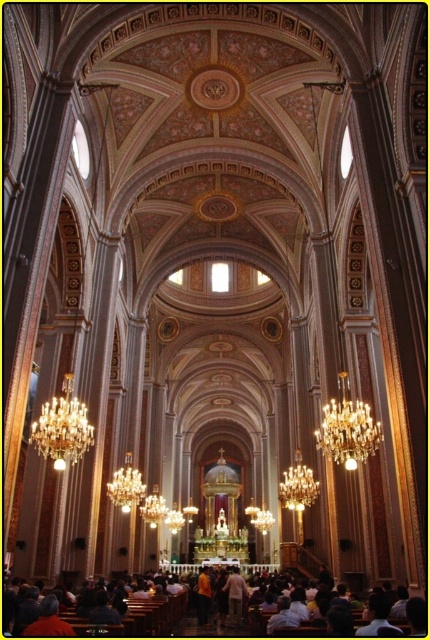
Does point (61, 387) come behind point (240, 589)?

That is False.

From the picture: Between gold crystal chandelier at left and light beige fabric at center, which one is positioned higher?

gold crystal chandelier at left

Where is `gold crystal chandelier at left`? The height and width of the screenshot is (640, 430). gold crystal chandelier at left is located at coordinates (63, 428).

Locate an element on the screen. The width and height of the screenshot is (430, 640). gold crystal chandelier at left is located at coordinates (63, 428).

Looking at this image, between crystal gold chandelier at center and gold crystal chandelier at left, which one appears on the left side from the viewer's perspective?

From the viewer's perspective, gold crystal chandelier at left appears more on the left side.

Can you confirm if crystal gold chandelier at center is positioned to the left of gold crystal chandelier at left?

No, crystal gold chandelier at center is not to the left of gold crystal chandelier at left.

Locate an element on the screen. crystal gold chandelier at center is located at coordinates (347, 428).

This screenshot has height=640, width=430. Find the location of `crystal gold chandelier at center`. crystal gold chandelier at center is located at coordinates (347, 428).

Is crystal gold chandelier at center closer to the viewer compared to light beige fabric at center?

Yes, crystal gold chandelier at center is closer to the viewer.

Is point (374, 420) more distant than point (227, 602)?

No, (374, 420) is in front of (227, 602).

Identify the location of crystal gold chandelier at center. (347, 428).